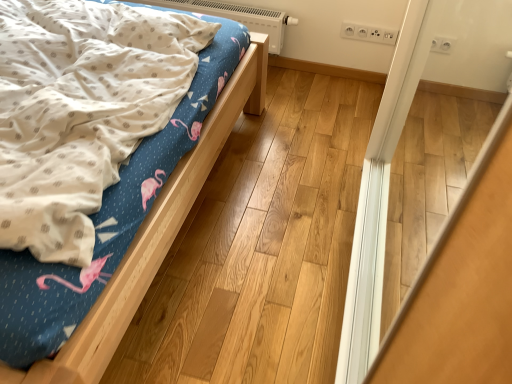
The width and height of the screenshot is (512, 384). Identify the location of free point above white plastic heater at upper center (from a real-world perspective). (241, 3).